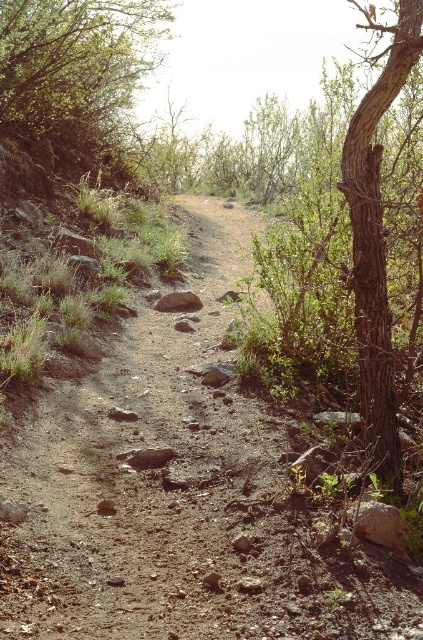
You are planning to walk along the dusty brown dirt track at center and want to know if there is enough space for a 2m wide tent. The green leafy tree at upper left is nearby. Based on the scene, can the tent fit on the track?

The dusty brown dirt track at center has a lesser width compared to the green leafy tree at upper left. Since the track is narrower than the tree, it might not be wide enough to accommodate a 2m wide tent. Check the actual width of the track before deciding.

You are standing on the dirt path in the wooded area and see two points marked in the scene. The first point is at coordinates point (x=296, y=428) and the second point is at point (x=30, y=45). Which point is closer to you?

Point (x=296, y=428) is closer to the viewer than point (x=30, y=45).